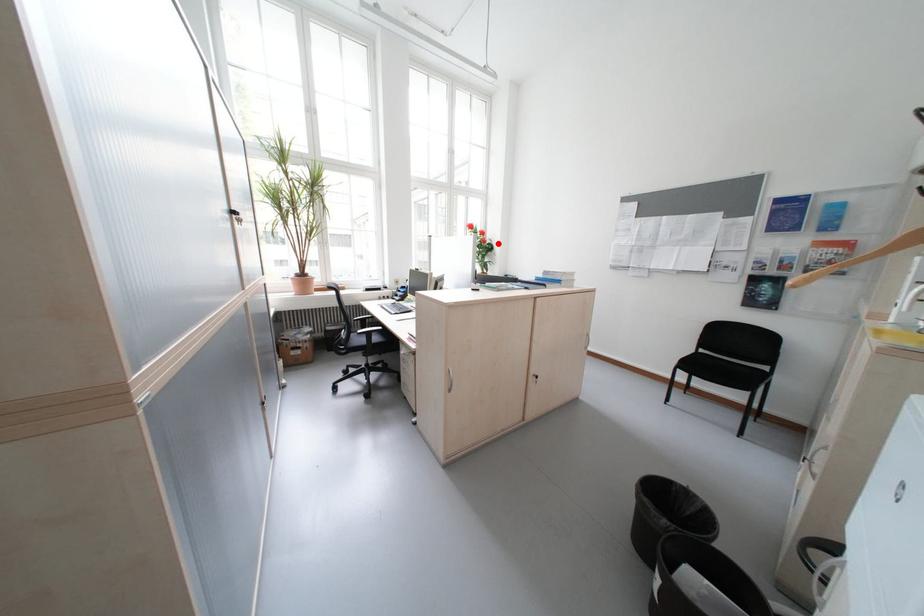
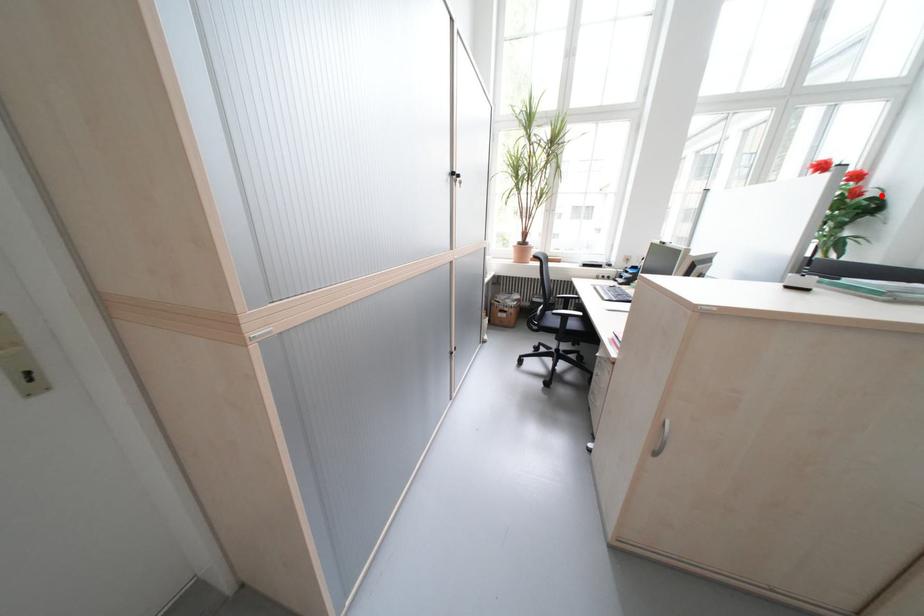
I am providing you with two images of the same scene from different viewpoints. A red point is marked on the first image and another point is marked on the second image. Is the red point in image1 aligned with the point shown in image2?

Yes